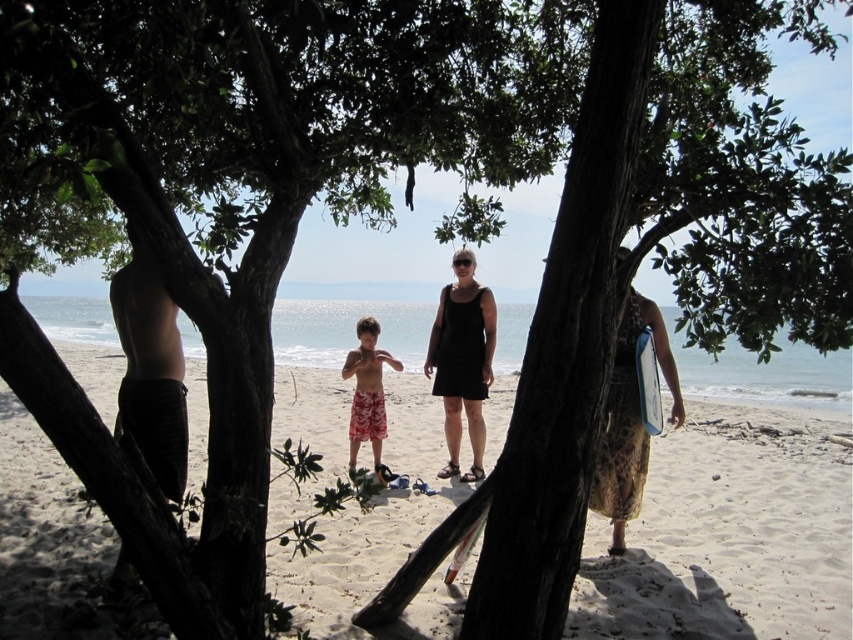
Who is shorter, printed fabric dress at right or white matte surfboard at center?

Standing shorter between the two is white matte surfboard at center.

What do you see at coordinates (630, 420) in the screenshot? I see `printed fabric dress at right` at bounding box center [630, 420].

Between point (646, 323) and point (640, 372), which one is positioned behind?

Point (646, 323)

Where is `printed fabric dress at right`? printed fabric dress at right is located at coordinates (630, 420).

Between point (631, 480) and point (357, 404), which one is positioned behind?

The point (357, 404) is more distant.

This screenshot has height=640, width=853. Find the location of `printed fabric dress at right`. printed fabric dress at right is located at coordinates (630, 420).

Which is below, beige sand at center or printed fabric dress at right?

beige sand at center

Who is taller, beige sand at center or printed fabric dress at right?

With more height is printed fabric dress at right.

At what (x,y) coordinates should I click in order to perform the action: click on beige sand at center. Please return your answer as a coordinate pair (x, y). Looking at the image, I should click on (728, 536).